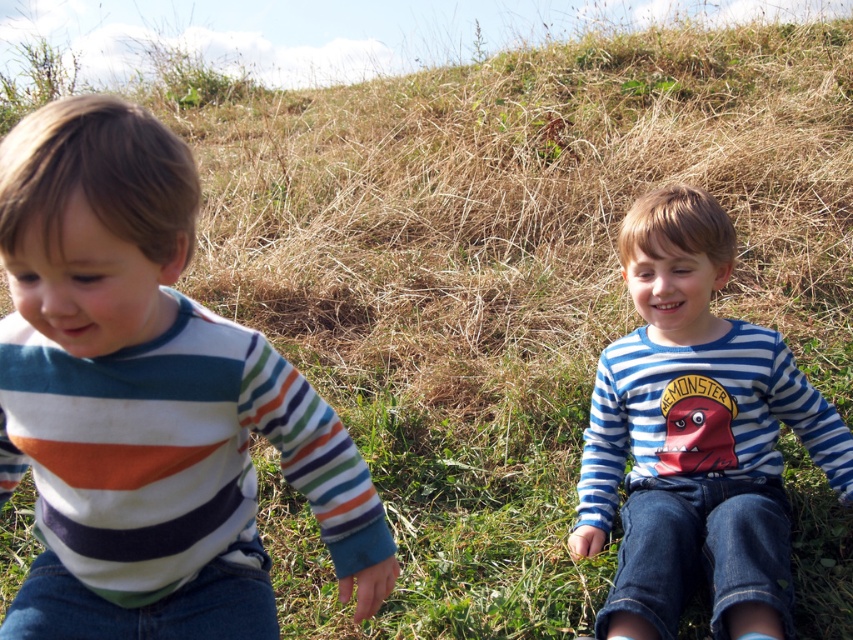
Does point (137, 209) lie behind point (639, 413)?

That is False.

Can you confirm if striped cotton shirt at left is taller than blue striped shirt at center?

Incorrect, striped cotton shirt at left's height is not larger of blue striped shirt at center's.

Image resolution: width=853 pixels, height=640 pixels. What do you see at coordinates (148, 401) in the screenshot?
I see `striped cotton shirt at left` at bounding box center [148, 401].

You are a GUI agent. You are given a task and a screenshot of the screen. Output one action in this format:
    pyautogui.click(x=<x>, y=<y>)
    Task: Click on the striped cotton shirt at left
    Image resolution: width=853 pixels, height=640 pixels.
    Given the screenshot: What is the action you would take?
    pyautogui.click(x=148, y=401)